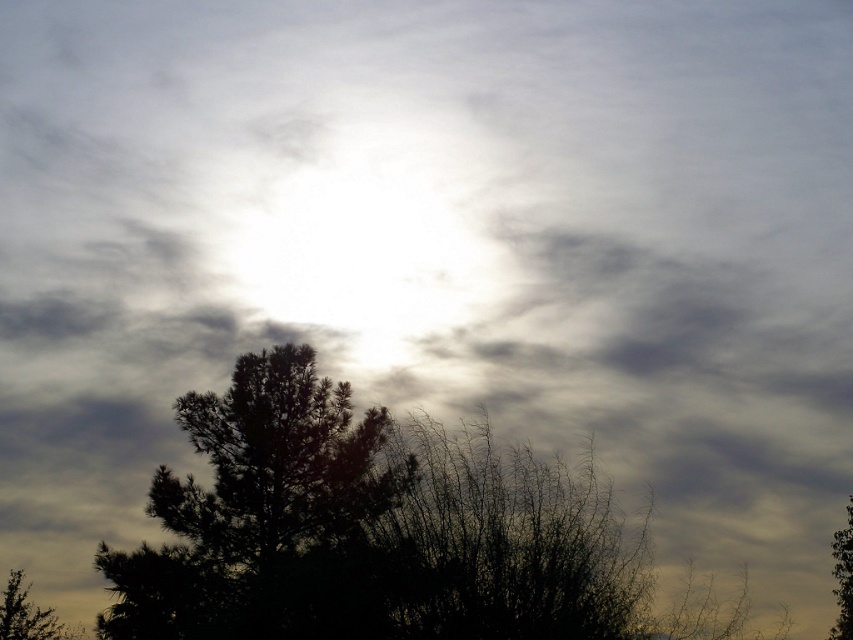
You are a bird looking for a place to perch. You see two trees in the foreground of the sky scene. Which tree, the dark green textured tree at lower left or the dark green leafy tree at lower left, is located to the right of the other?

The dark green textured tree at lower left is positioned on the right side of the dark green leafy tree at lower left.

You are standing in the scene and want to locate the dark green textured tree at lower left. What are its coordinates?

The dark green textured tree at lower left is located at coordinates point (264, 515).

You are standing in a field and see the dark green leafy tree at lower left and the green leafy tree at lower right. Which tree is closer to your left side?

The dark green leafy tree at lower left is closer to your left side because it is positioned on the left side of the green leafy tree at lower right.